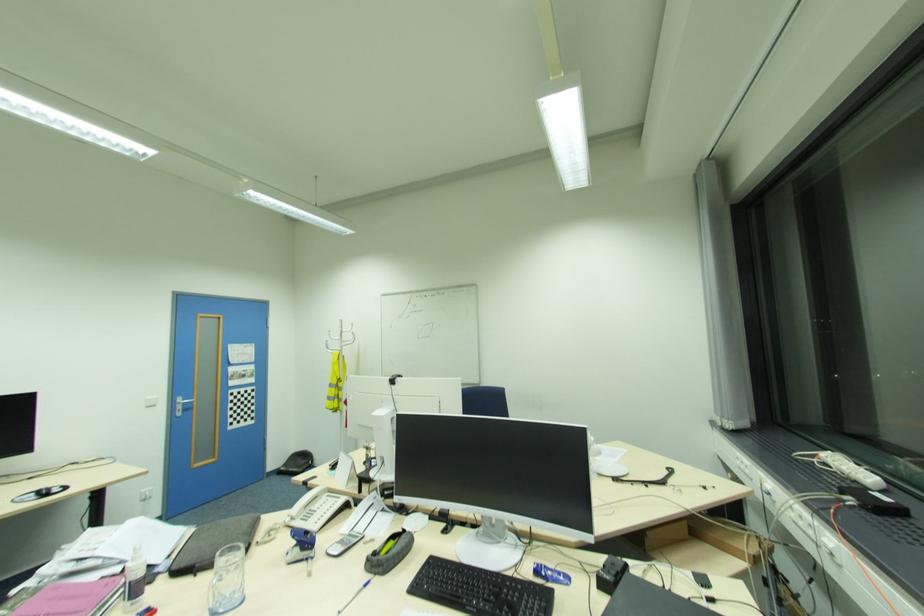
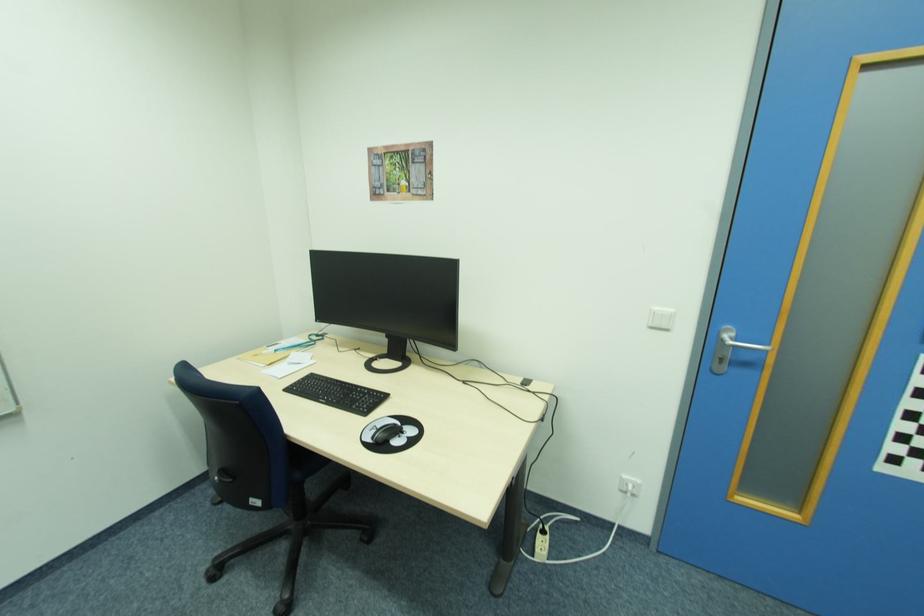
Where in the second image is the point corresponding to (x=157, y=406) from the first image?

(670, 329)